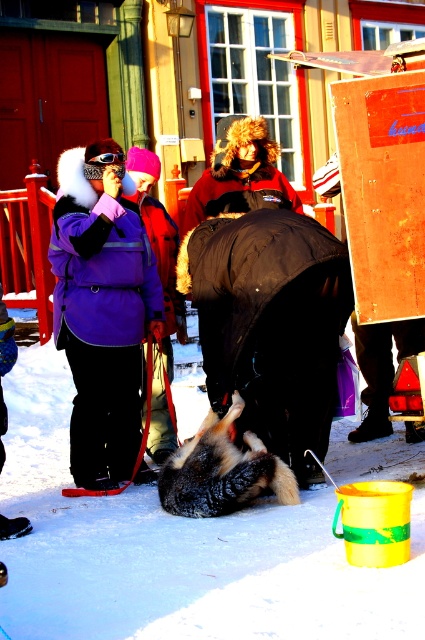
Question: Which point is closer to the camera taking this photo?

Choices:
 (A) (238, 148)
 (B) (142, 196)
 (C) (62, 157)
 (D) (266, 474)

Answer: (D)

Question: Does white fluffy snow at center have a lesser width compared to brown fur dog at center?

Choices:
 (A) yes
 (B) no

Answer: (A)

Question: Can you confirm if purple fleece jacket at upper left is thinner than brown fur hat at center?

Choices:
 (A) yes
 (B) no

Answer: (A)

Question: Which of these objects is positioned closest to the brown fur hat at center?

Choices:
 (A) white fluffy snow at center
 (B) brown fur dog at center
 (C) purple fleece jacket at upper left
 (D) matte purple jacket at center

Answer: (C)

Question: Which object is the closest to the brown fur hat at center?

Choices:
 (A) brown fur dog at center
 (B) matte purple jacket at center

Answer: (B)

Question: From the image, what is the correct spatial relationship of matte purple jacket at center in relation to brown fur dog at center?

Choices:
 (A) below
 (B) above

Answer: (B)